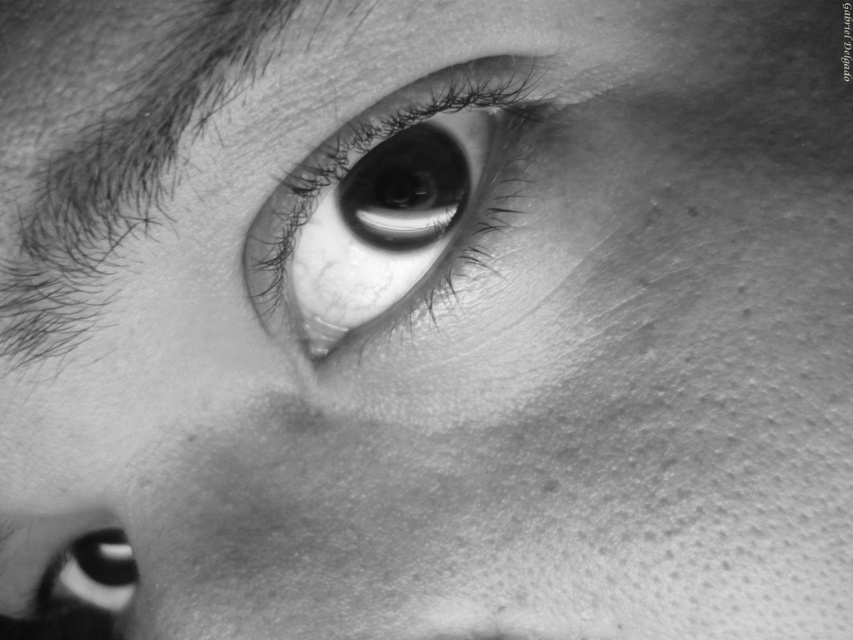
From the picture: Who is taller, smooth skin eye at center or smooth black eye at lower left?

smooth skin eye at center is taller.

Does smooth skin eye at center have a smaller size compared to smooth black eye at lower left?

Incorrect, smooth skin eye at center is not smaller in size than smooth black eye at lower left.

Is point (347, 298) more distant than point (76, 566)?

No, it is not.

Where is `smooth skin eye at center`? This screenshot has height=640, width=853. smooth skin eye at center is located at coordinates (390, 205).